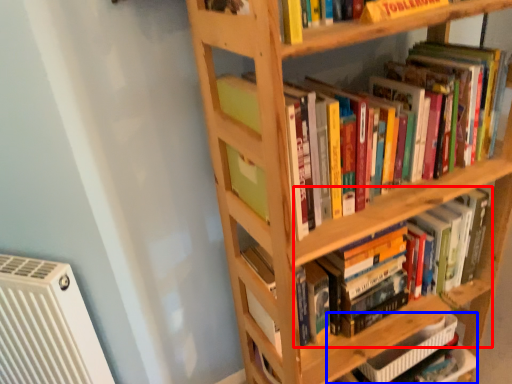
Question: Which point is closer to the camera, book (highlighted by a red box) or book (highlighted by a blue box)?

Choices:
 (A) book
 (B) book

Answer: (A)